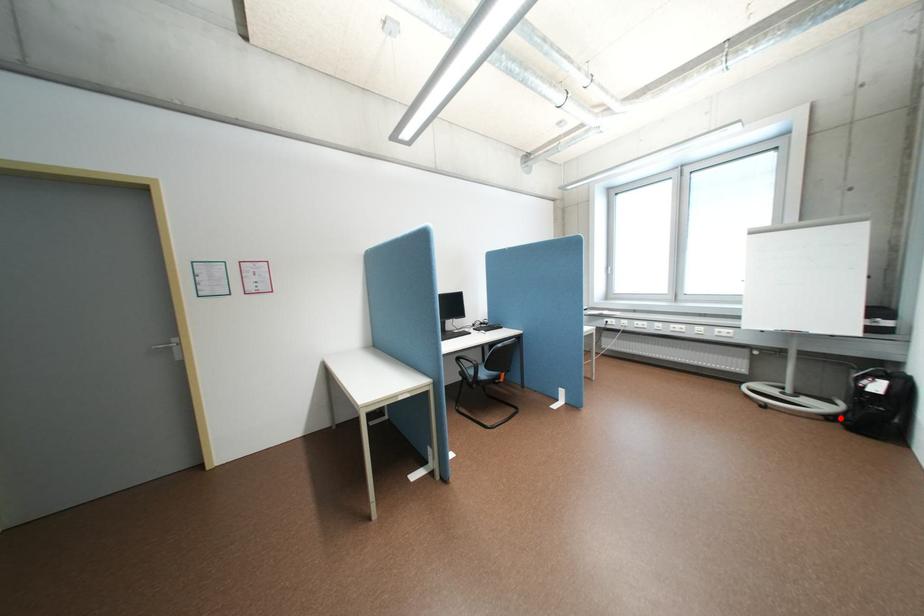
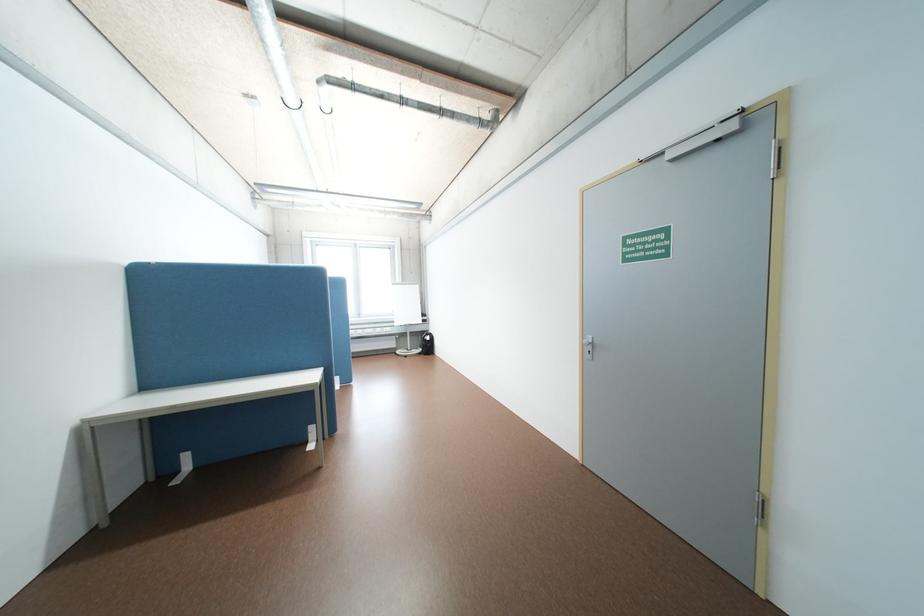
Locate, in the second image, the point that corresponds to the highlighted location in the first image.

(431, 353)